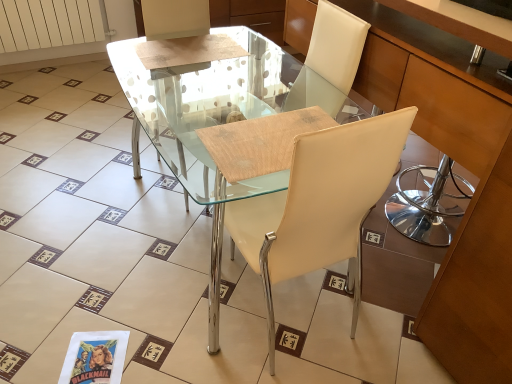
Find the location of `free area in between matte white chair at center and transparent glass table at center`. free area in between matte white chair at center and transparent glass table at center is located at coordinates (280, 352).